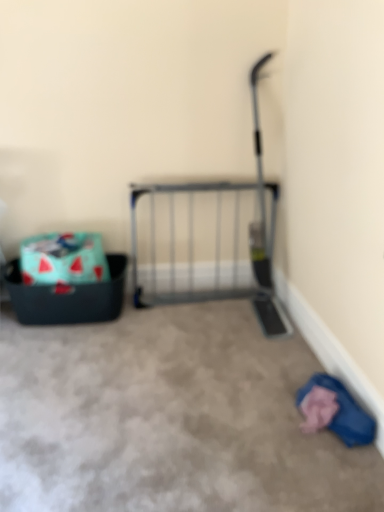
Question: Is carpet at center oriented towards metal gate at center?

Choices:
 (A) yes
 (B) no

Answer: (B)

Question: From a real-world perspective, is carpet at center located beneath metal gate at center?

Choices:
 (A) yes
 (B) no

Answer: (A)

Question: Can you confirm if carpet at center is positioned to the left of metal gate at center?

Choices:
 (A) no
 (B) yes

Answer: (B)

Question: Is carpet at center behind metal gate at center?

Choices:
 (A) yes
 (B) no

Answer: (B)

Question: Would you say carpet at center is a long distance from metal gate at center?

Choices:
 (A) yes
 (B) no

Answer: (B)

Question: Does carpet at center have a lesser height compared to metal gate at center?

Choices:
 (A) no
 (B) yes

Answer: (B)

Question: Is blue fabric at lower right outside of carpet at center?

Choices:
 (A) no
 (B) yes

Answer: (B)

Question: Does blue fabric at lower right have a lesser height compared to carpet at center?

Choices:
 (A) no
 (B) yes

Answer: (A)

Question: From the image's perspective, is blue fabric at lower right on carpet at center?

Choices:
 (A) no
 (B) yes

Answer: (A)

Question: Is the position of blue fabric at lower right less distant than that of carpet at center?

Choices:
 (A) no
 (B) yes

Answer: (A)

Question: Can you confirm if blue fabric at lower right is smaller than carpet at center?

Choices:
 (A) no
 (B) yes

Answer: (B)

Question: Would you say blue fabric at lower right is a long distance from carpet at center?

Choices:
 (A) no
 (B) yes

Answer: (A)

Question: From a real-world perspective, is metal gate at center beneath carpet at center?

Choices:
 (A) no
 (B) yes

Answer: (A)